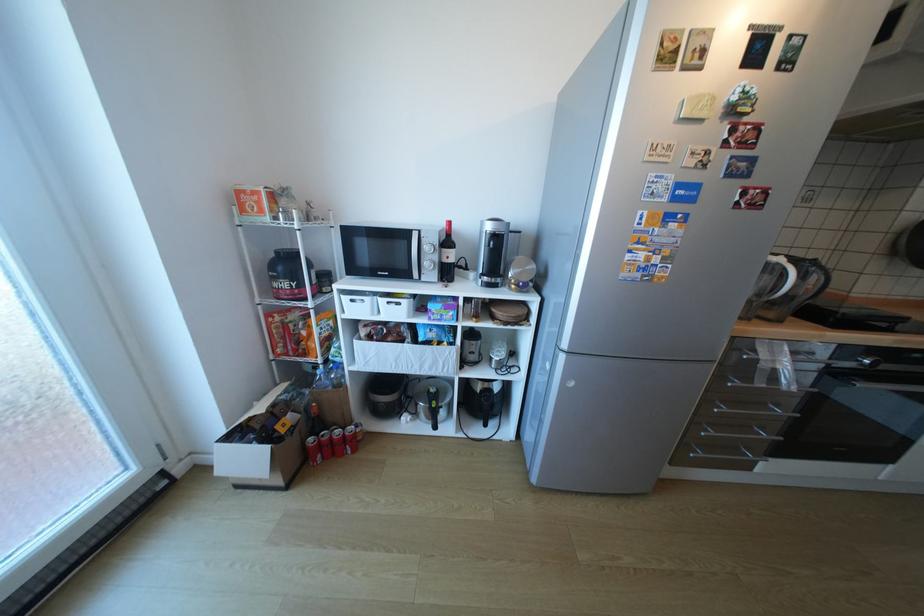
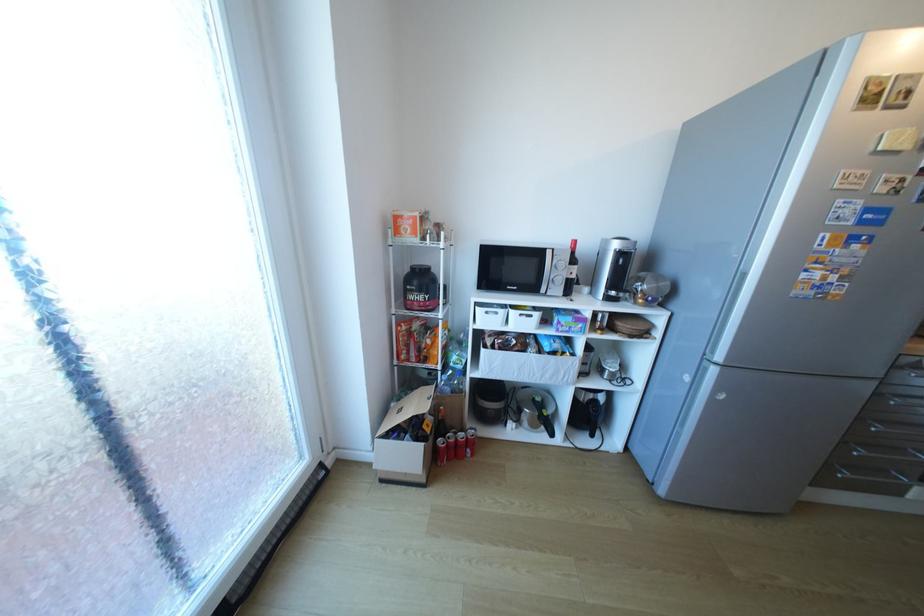
Find the pixel in the second image that matches (329,440) in the first image.

(456, 442)